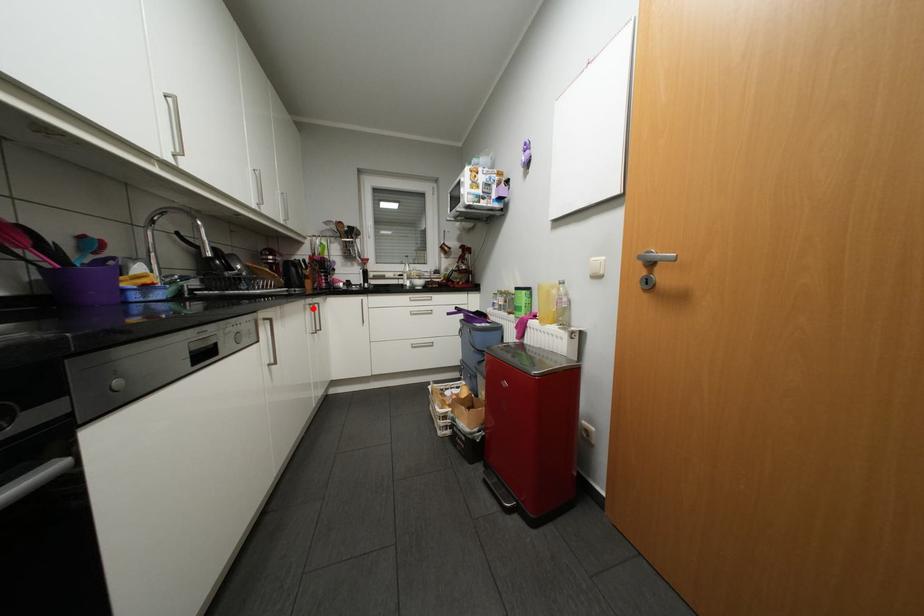
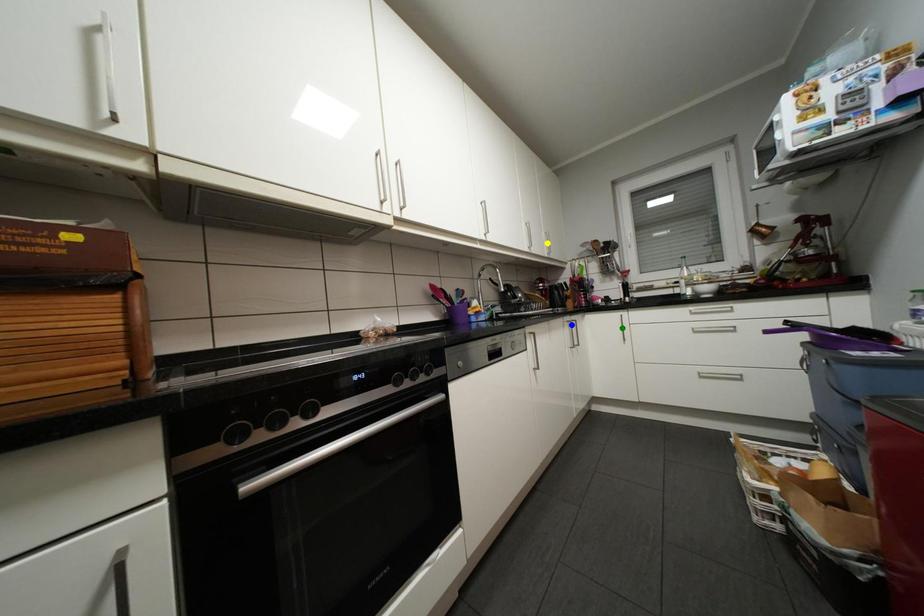
Question: I am providing you with two images of the same scene from different viewpoints. A red point is marked on the first image. You are given multiple points on the second image. Which spot in image 2 lines up with the point in image 1?

Choices:
 (A) blue point
 (B) yellow point
 (C) green point

Answer: (A)